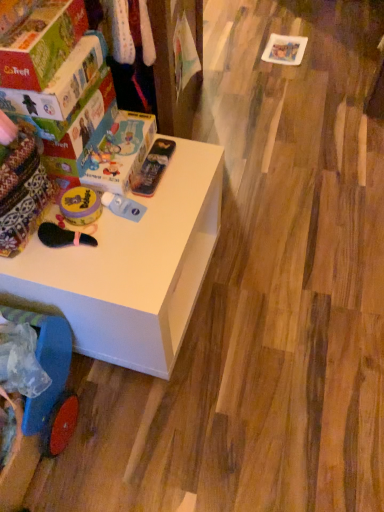
Locate an element on the screen. The width and height of the screenshot is (384, 512). free spot in front of white matte table at upper left is located at coordinates (187, 434).